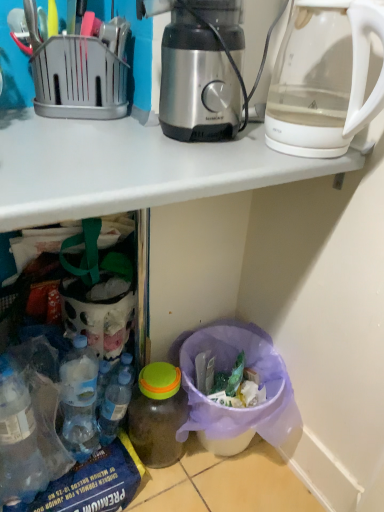
Question: Is translucent plastic bottle at lower center, marked as the first bottle in a right-to-left arrangement, oriented towards stainless steel coffee maker at center?

Choices:
 (A) no
 (B) yes

Answer: (A)

Question: Would you say translucent plastic bottle at lower center, the second bottle when ordered from left to right, contains stainless steel coffee maker at center?

Choices:
 (A) yes
 (B) no

Answer: (B)

Question: Does translucent plastic bottle at lower center, the second bottle when ordered from left to right, have a larger size compared to stainless steel coffee maker at center?

Choices:
 (A) no
 (B) yes

Answer: (A)

Question: Is translucent plastic bottle at lower center, marked as the first bottle in a right-to-left arrangement, positioned with its back to stainless steel coffee maker at center?

Choices:
 (A) no
 (B) yes

Answer: (A)

Question: From a real-world perspective, is translucent plastic bottle at lower center, the second bottle when ordered from left to right, located beneath stainless steel coffee maker at center?

Choices:
 (A) no
 (B) yes

Answer: (B)

Question: Considering the positions of blue translucent bottle at lower left, the second bottle positioned from the right, and stainless steel coffee maker at center in the image, is blue translucent bottle at lower left, the second bottle positioned from the right, taller or shorter than stainless steel coffee maker at center?

Choices:
 (A) short
 (B) tall

Answer: (A)

Question: In terms of width, does blue translucent bottle at lower left, the 1th bottle from the left, look wider or thinner when compared to stainless steel coffee maker at center?

Choices:
 (A) wide
 (B) thin

Answer: (B)

Question: From a real-world perspective, is blue translucent bottle at lower left, the 1th bottle from the left, above or below stainless steel coffee maker at center?

Choices:
 (A) above
 (B) below

Answer: (B)

Question: Considering their positions, is blue translucent bottle at lower left, the 1th bottle from the left, located in front of or behind stainless steel coffee maker at center?

Choices:
 (A) front
 (B) behind

Answer: (B)

Question: Is translucent plastic bottle at lower center, the second bottle when ordered from left to right, in front of or behind transparent glass kettle at upper right in the image?

Choices:
 (A) behind
 (B) front

Answer: (A)

Question: Is translucent plastic bottle at lower center, the second bottle when ordered from left to right, taller or shorter than transparent glass kettle at upper right?

Choices:
 (A) tall
 (B) short

Answer: (A)

Question: Which is correct: translucent plastic bottle at lower center, marked as the first bottle in a right-to-left arrangement, is inside transparent glass kettle at upper right, or outside of it?

Choices:
 (A) inside
 (B) outside

Answer: (B)

Question: From the image's perspective, is translucent plastic bottle at lower center, marked as the first bottle in a right-to-left arrangement, above or below transparent glass kettle at upper right?

Choices:
 (A) below
 (B) above

Answer: (A)

Question: Which is correct: blue translucent bottle at lower left, the 1th bottle from the left, is inside translucent plastic bottle at lower center, the second bottle when ordered from left to right, or outside of it?

Choices:
 (A) outside
 (B) inside

Answer: (A)

Question: Considering the positions of blue translucent bottle at lower left, the 1th bottle from the left, and translucent plastic bottle at lower center, the second bottle when ordered from left to right, in the image, is blue translucent bottle at lower left, the 1th bottle from the left, wider or thinner than translucent plastic bottle at lower center, the second bottle when ordered from left to right,?

Choices:
 (A) thin
 (B) wide

Answer: (A)